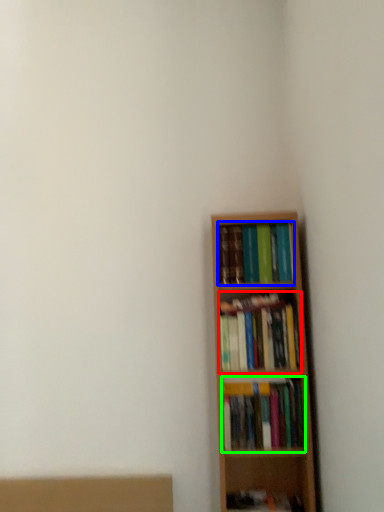
Question: Based on their relative distances, which object is farther from book (highlighted by a red box)? Choose from book (highlighted by a blue box) and book (highlighted by a green box).

Choices:
 (A) book
 (B) book

Answer: (A)